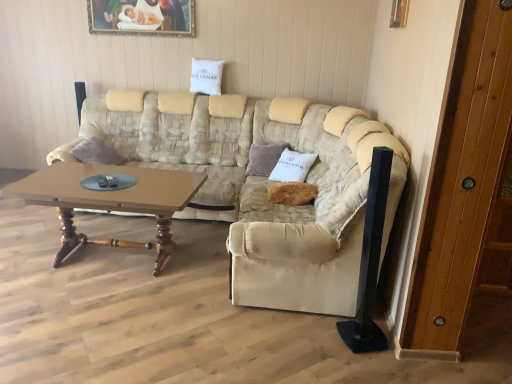
Where is `empty space that is ontop of brown wooden coffee table at center (from a real-world perspective)`? Image resolution: width=512 pixels, height=384 pixels. empty space that is ontop of brown wooden coffee table at center (from a real-world perspective) is located at coordinates (119, 184).